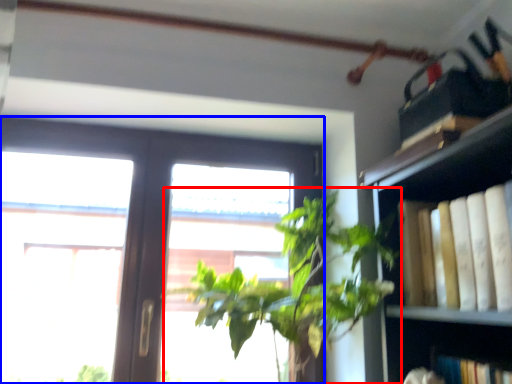
Question: Which object is further to the camera taking this photo, houseplant (highlighted by a red box) or window (highlighted by a blue box)?

Choices:
 (A) houseplant
 (B) window

Answer: (B)